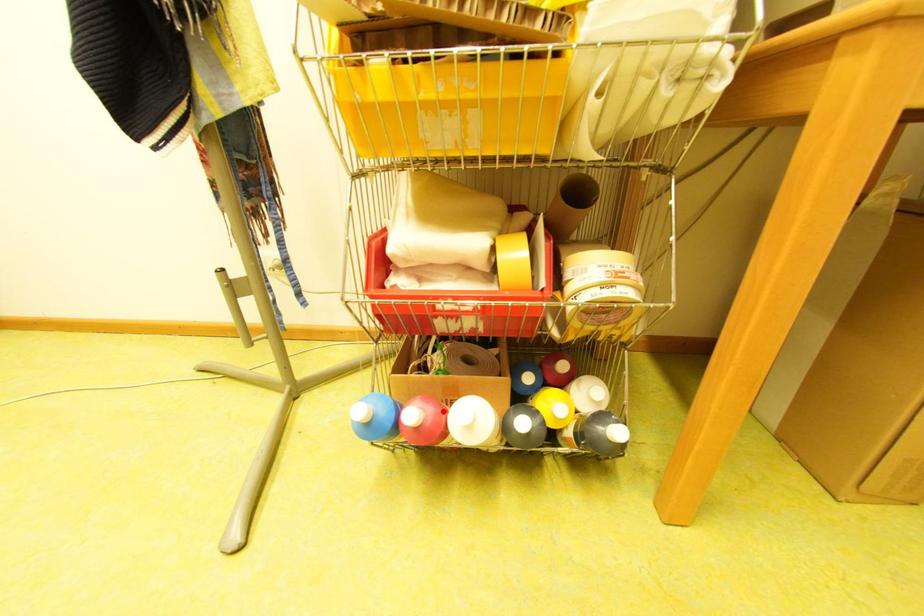
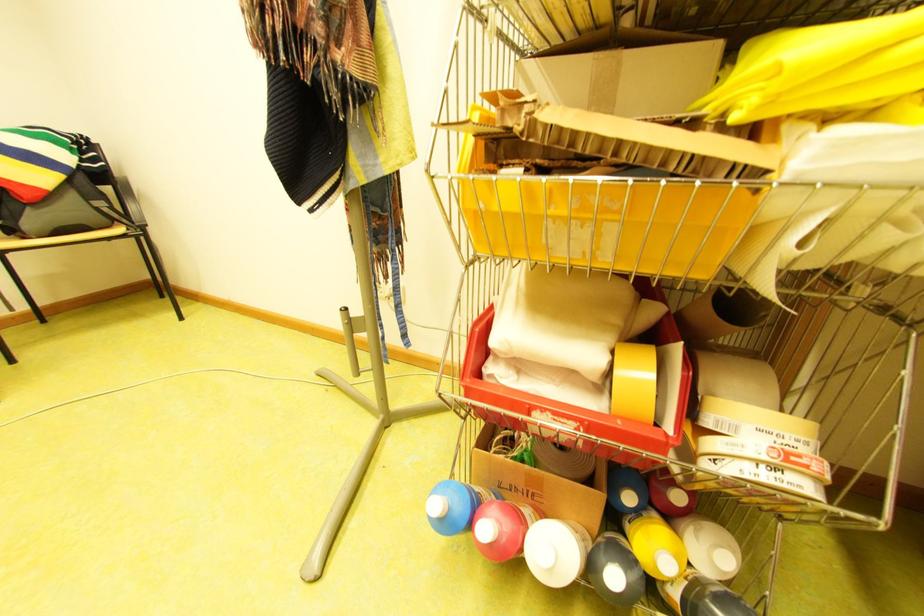
Question: I am providing you with two images of the same scene from different viewpoints. Image1 has a red point marked. In image2, the corresponding 3D location appears at what relative position? Reply with the corresponding letter.

Choices:
 (A) Closer
 (B) Farther

Answer: (B)